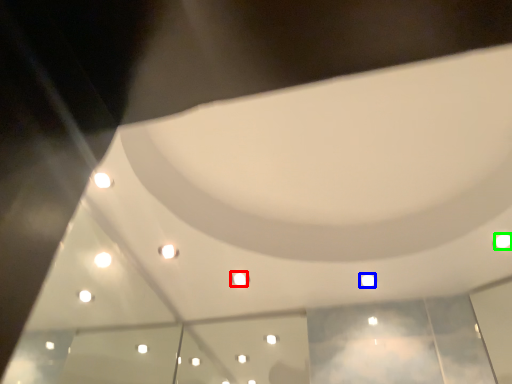
Question: Which object is positioned closest to light (highlighted by a red box)? Select from light (highlighted by a blue box) and light (highlighted by a green box).

Choices:
 (A) light
 (B) light

Answer: (A)